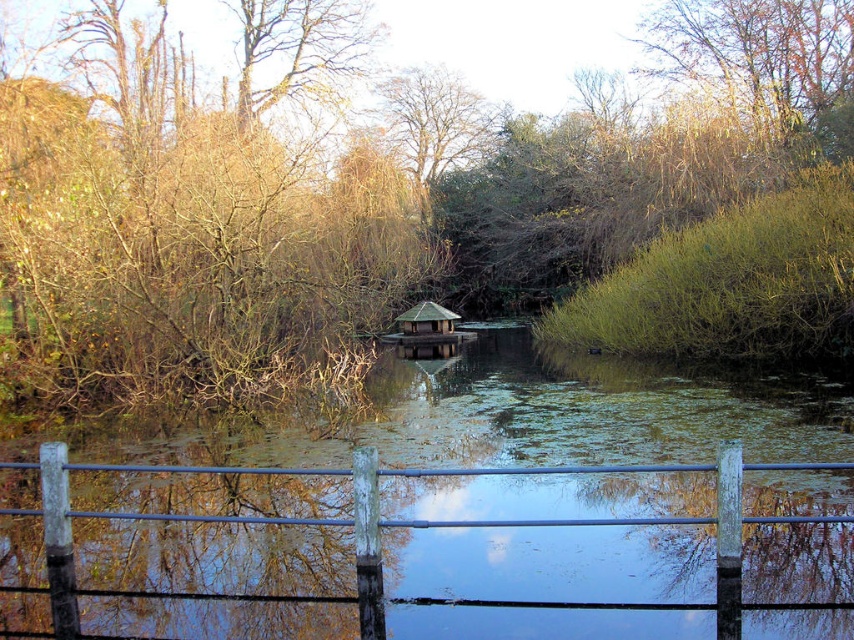
Question: Which of these objects is positioned farthest from the brown leafy tree at upper center?

Choices:
 (A) brown leafless tree at center
 (B) wooden fence at center

Answer: (B)

Question: Which point is farther from the camera taking this photo?

Choices:
 (A) (817, 129)
 (B) (215, 518)
 (C) (670, 259)

Answer: (A)

Question: Considering the relative positions of brown leafless tree at center and wooden fence at center in the image provided, where is brown leafless tree at center located with respect to wooden fence at center?

Choices:
 (A) left
 (B) right

Answer: (B)

Question: Does wooden fence at center appear on the right side of brown leafy tree at upper center?

Choices:
 (A) no
 (B) yes

Answer: (A)

Question: Which object is closer to the camera taking this photo?

Choices:
 (A) brown leafy tree at upper center
 (B) wooden fence at center
 (C) brown leafless tree at center

Answer: (B)

Question: Is wooden fence at center smaller than brown leafy tree at upper center?

Choices:
 (A) yes
 (B) no

Answer: (A)